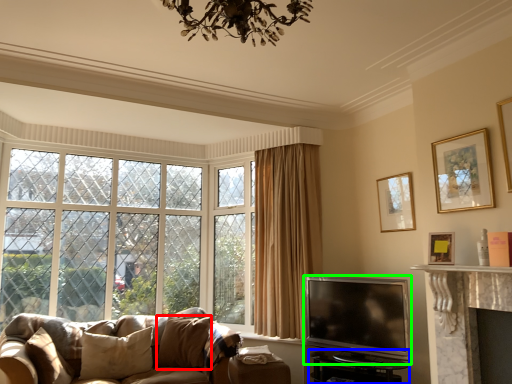
Question: Which is nearer to the pillow (highlighted by a red box)? table (highlighted by a blue box) or television (highlighted by a green box).

Choices:
 (A) table
 (B) television

Answer: (B)